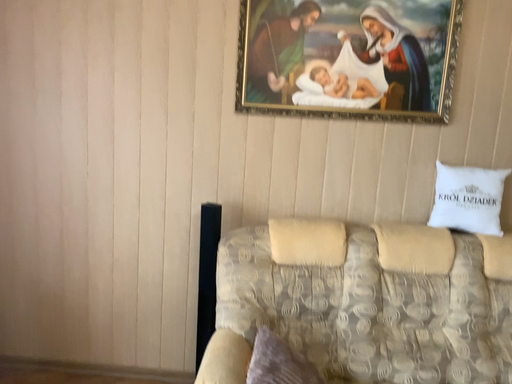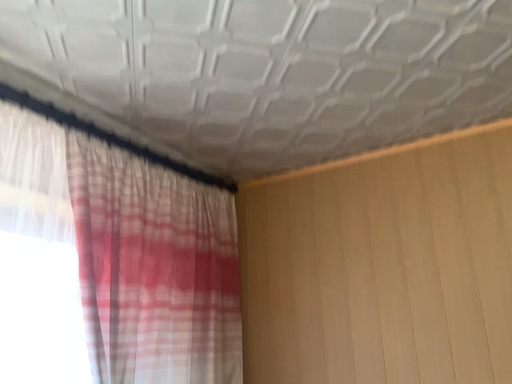
Question: Which way did the camera rotate in the video?

Choices:
 (A) rotated left
 (B) rotated right

Answer: (A)